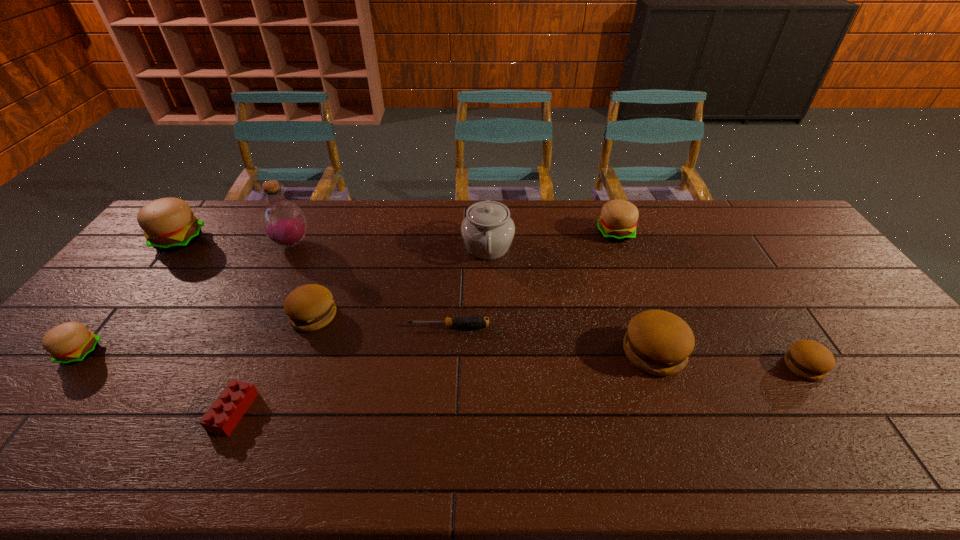
Find the location of a particular element. The height and width of the screenshot is (540, 960). the shortest hamburger is located at coordinates (808, 359).

The image size is (960, 540). What are the coordinates of `the second shortest object` in the screenshot? It's located at (226, 411).

At what (x,y) coordinates should I click in order to perform the action: click on Lego. Please return your answer as a coordinate pair (x, y). This screenshot has height=540, width=960. Looking at the image, I should click on (226, 411).

You are a GUI agent. You are given a task and a screenshot of the screen. Output one action in this format:
    pyautogui.click(x=<x>, y=<y>)
    Task: Click on the shortest object
    The width and height of the screenshot is (960, 540).
    Given the screenshot: What is the action you would take?
    pyautogui.click(x=475, y=321)

Identify the location of vacant region located on the right of the bottle. (326, 244).

In order to click on blank area located 0.060m on the back of the white chinaware in this screenshot , I will do `click(487, 217)`.

At what (x,y) coordinates should I click in order to perform the action: click on free location located 0.060m on the back of the tallest hamburger. Please return your answer as a coordinate pair (x, y). The width and height of the screenshot is (960, 540). Looking at the image, I should click on (198, 217).

The image size is (960, 540). In order to click on vacant area located on the right of the rightmost beige hamburger in this screenshot , I will do `click(680, 233)`.

What are the coordinates of `free space located 0.360m on the right of the biggest brown hamburger` in the screenshot? It's located at point(823,352).

I want to click on free space located 0.140m on the front of the second biggest brown hamburger, so click(x=291, y=377).